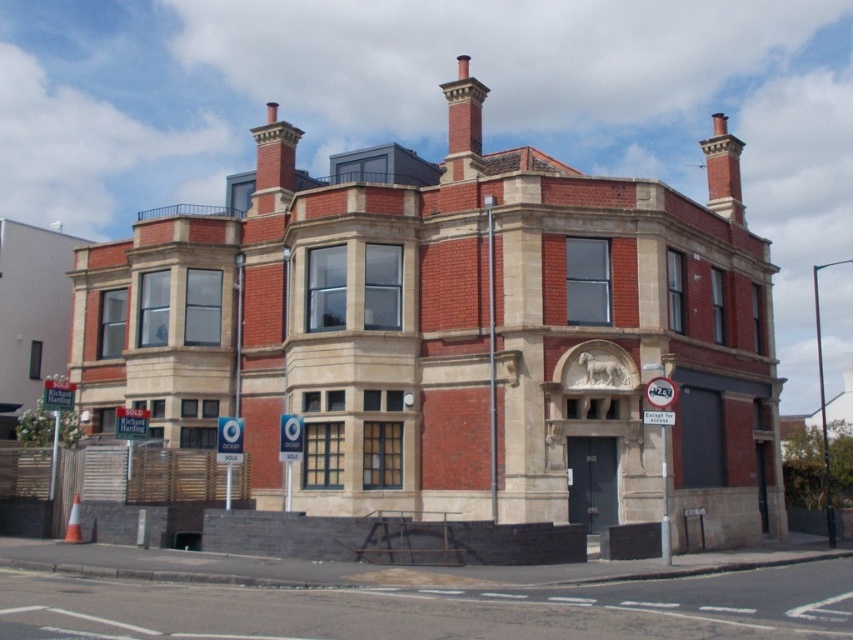
You are a delivery person trying to locate the entrance to the Victorian building. You see the red brick chimney at upper center and the asphalt at lower center. Which direction should you head towards to find the entrance?

The entrance is likely below the red brick chimney at upper center, so you should head towards the area near the asphalt at lower center since the chimney is above it.

You are a delivery person trying to determine the best path to the entrance of the Victorian building. You see the red brick chimney at upper center and the asphalt at lower center. Which object is closer to the entrance?

The asphalt at lower center is closer to the entrance because it is located at the lower center of the building, which is typically where the entrance would be situated. The red brick chimney at upper center is positioned higher up and likely farther from the entrance.